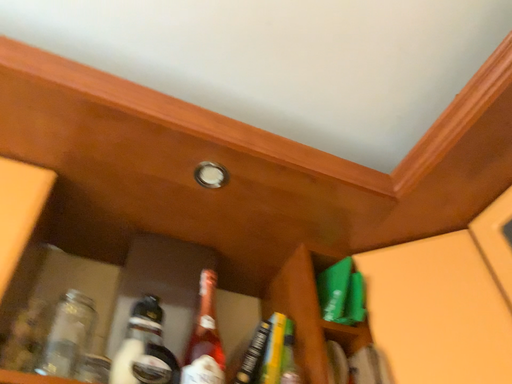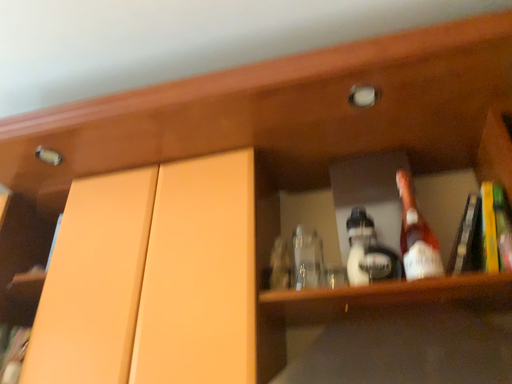
Question: How did the camera likely rotate when shooting the video?

Choices:
 (A) rotated downward
 (B) rotated upward

Answer: (A)